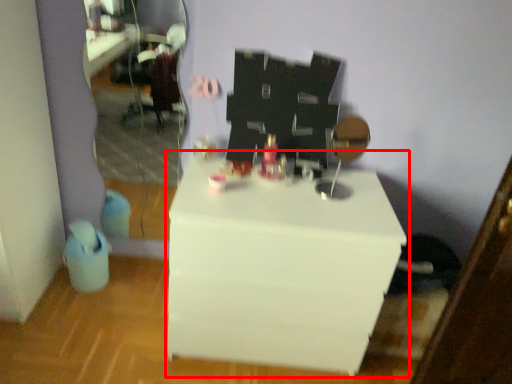
Question: From the image's perspective, what is the correct spatial relationship of table (annotated by the red box) in relation to mirror?

Choices:
 (A) above
 (B) below

Answer: (B)